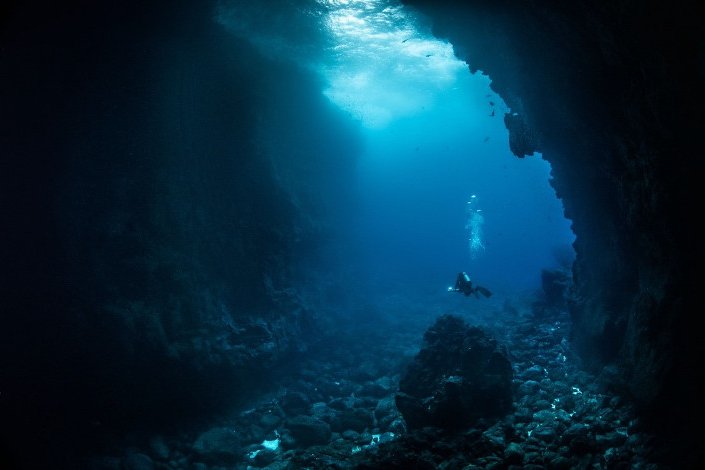
The height and width of the screenshot is (470, 705). Find the location of `sub beam`. sub beam is located at coordinates pos(350,26).